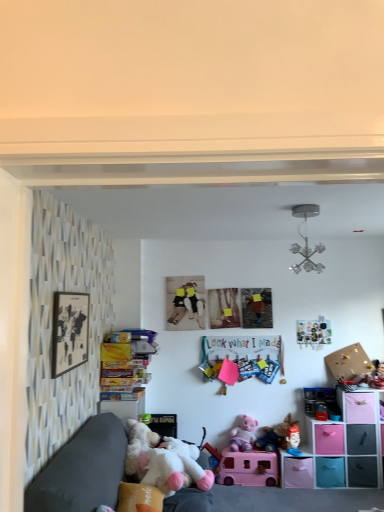
Question: Would you say matte black picture frame at left is inside or outside pink plush toy at lower center, marked as the fifth toy in a top-to-bottom arrangement?

Choices:
 (A) inside
 (B) outside

Answer: (B)

Question: Is matte black picture frame at left in front of or behind pink plush toy at lower center, marked as the fifth toy in a top-to-bottom arrangement, in the image?

Choices:
 (A) behind
 (B) front

Answer: (B)

Question: Which of these objects is positioned farthest from the corkboard at upper right?

Choices:
 (A) pink plush toy at lower center, the fourth toy viewed from the top
 (B) metallic chandelier at upper center, marked as the 7th toy in a bottom-to-top arrangement
 (C) pink plush toy at lower center, marked as the fifth toy in a top-to-bottom arrangement
 (D) plush fabric toy at lower right, which ranks as the 2th toy in bottom-to-top order
 (E) matte black picture frame at left

Answer: (E)

Question: Which of these objects is positioned closest to the pink plastic storage cubes at lower right?

Choices:
 (A) pink plush toy at lower center, which is counted as the fourth toy, starting from the bottom
 (B) metallic chandelier at upper center, placed as the 1th toy when sorted from top to bottom
 (C) matte black picture frame at left
 (D) pink matte toy car at center, the 7th toy positioned from the top
 (E) translucent plastic toy car at right, which is the second toy from top to bottom

Answer: (E)